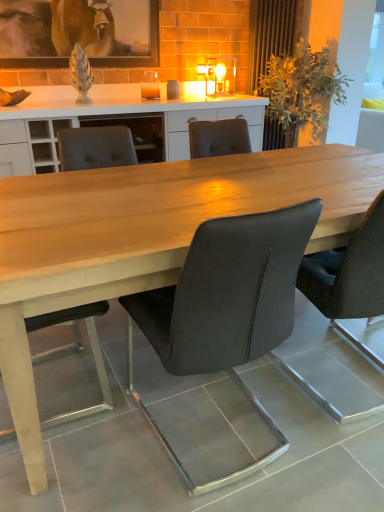
Question: Relative to matte wooden picture frame at upper center, is matte black chair at center, positioned as the 1th chair in right-to-left order, in front or behind?

Choices:
 (A) front
 (B) behind

Answer: (A)

Question: From the image's perspective, is matte black chair at center, positioned as the 1th chair in right-to-left order, positioned above or below matte wooden picture frame at upper center?

Choices:
 (A) above
 (B) below

Answer: (B)

Question: Which object is positioned closest to the matte black chair at center, marked as the 2th chair in a left-to-right arrangement?

Choices:
 (A) light wood table at center
 (B) matte wooden picture frame at upper center
 (C) matte black chair at center, which is counted as the 3th chair, starting from the left
 (D) matte black chair at center, which appears as the third chair when viewed from the right

Answer: (A)

Question: Which object is positioned farthest from the light wood table at center?

Choices:
 (A) matte wooden picture frame at upper center
 (B) matte black chair at center, positioned as the 1th chair in right-to-left order
 (C) matte black chair at center, the 1th chair viewed from the left
 (D) matte black chair at center, marked as the 2th chair in a left-to-right arrangement

Answer: (A)